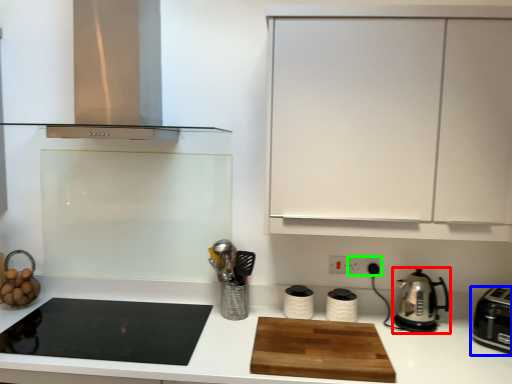
Question: Considering the real-world distances, which object is farthest from kitchen appliance (highlighted by a red box)? kitchen appliance (highlighted by a blue box) or electric outlet (highlighted by a green box)?

Choices:
 (A) kitchen appliance
 (B) electric outlet

Answer: (B)